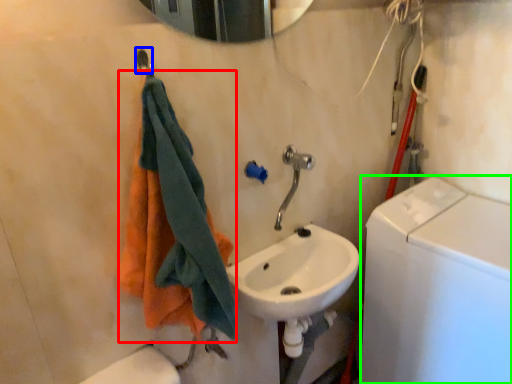
Question: Which object is positioned closest to towel (highlighted by a red box)? Select from shower (highlighted by a blue box) and washing machine (highlighted by a green box).

Choices:
 (A) shower
 (B) washing machine

Answer: (A)